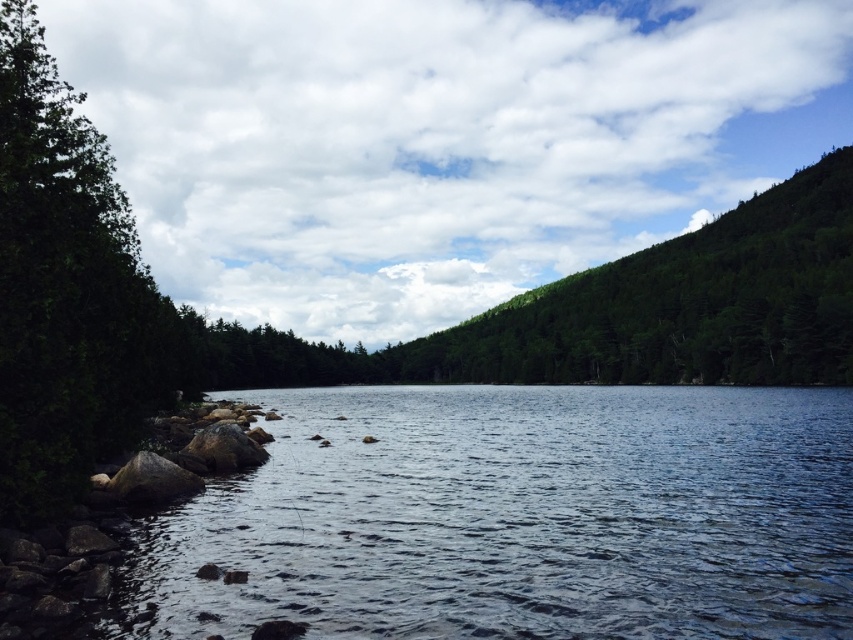
Which of these two, dark blue water at lower left or green leafy tree at left, stands taller?

green leafy tree at left

Can you confirm if dark blue water at lower left is positioned below green leafy tree at left?

Yes.

Does point (454, 552) come behind point (61, 284)?

No, it is not.

Find the location of a particular element. This screenshot has width=853, height=640. dark blue water at lower left is located at coordinates (518, 516).